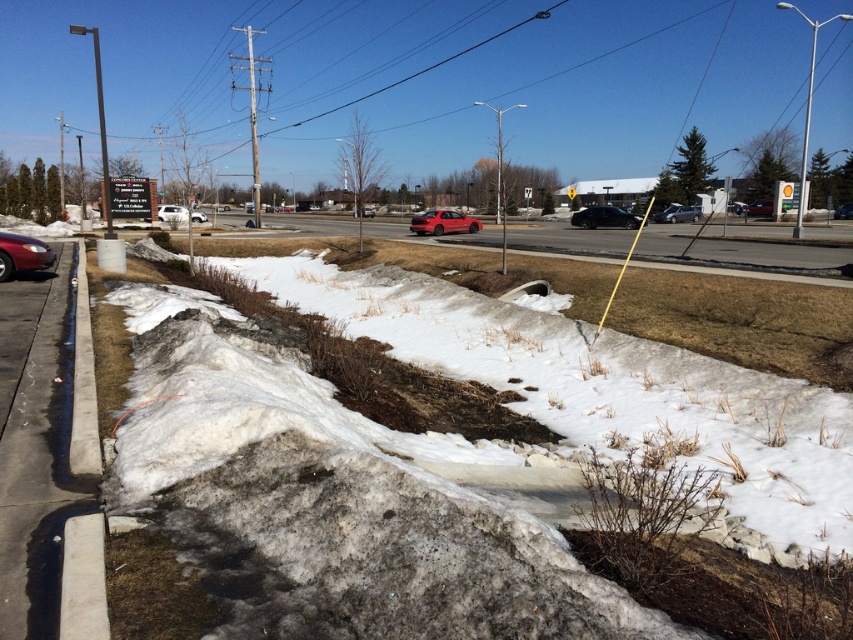
Is concrete at left thinner than white matte van at center?

Yes, concrete at left is thinner than white matte van at center.

How far apart are concrete at left and white matte van at center?

concrete at left is 26.62 meters away from white matte van at center.

Who is more forward, (96, 596) or (202, 214)?

Point (96, 596)

The width and height of the screenshot is (853, 640). Find the location of `concrete at left`. concrete at left is located at coordinates (83, 579).

Is point (465, 216) more distant than point (619, 220)?

No, it is in front of (619, 220).

Does shiny red sedan at center appear over black matte sedan at center?

Incorrect, shiny red sedan at center is not positioned above black matte sedan at center.

Find the location of a particular element. shiny red sedan at center is located at coordinates (444, 221).

Is white powdery snow at lower center behind concrete sidewalk at left?

That is False.

The image size is (853, 640). I want to click on white powdery snow at lower center, so click(x=344, y=496).

Identify the location of white powdery snow at lower center. (344, 496).